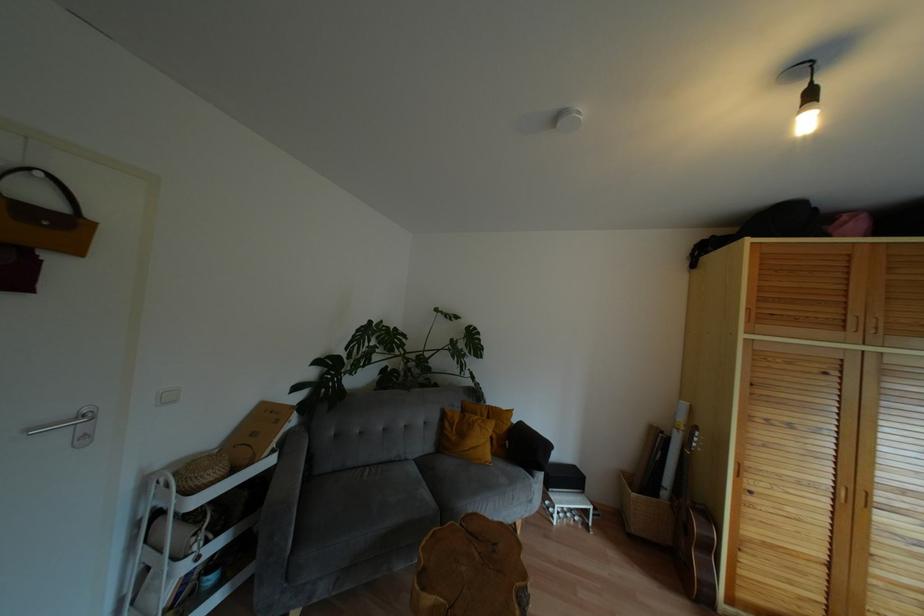
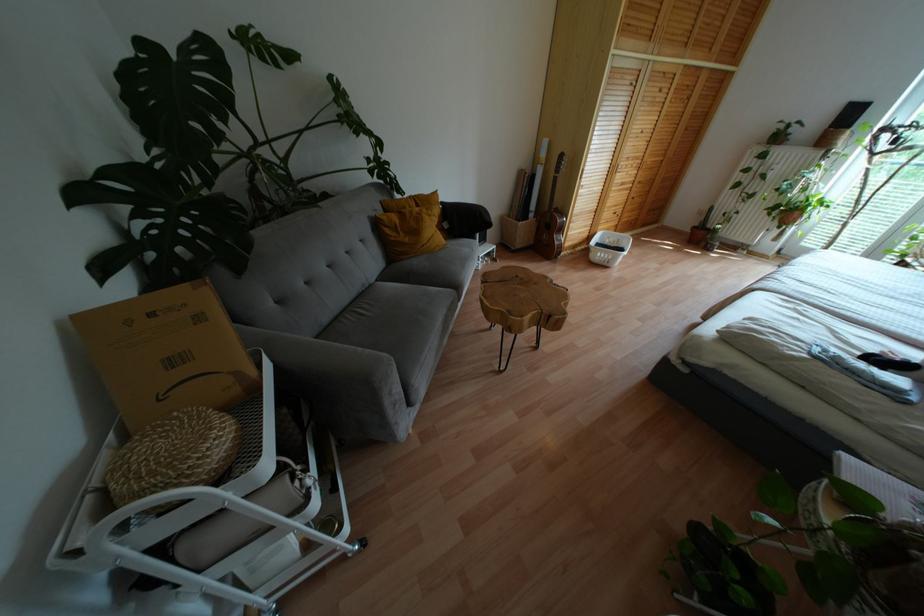
Find the pixel in the second image that matches (508,411) in the first image.

(434, 193)